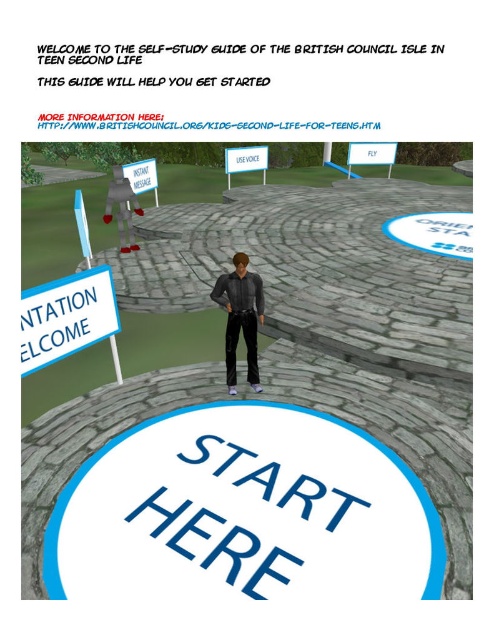
You are a visitor in this virtual environment and want to read the white plastic sign at center. Can you see the entire text on the sign while standing at the position of the matte black shirt at center?

The matte black shirt at center has a smaller size compared to white plastic sign at center. Since the shirt is smaller, it is likely that the sign is larger and can be read in full from that position.